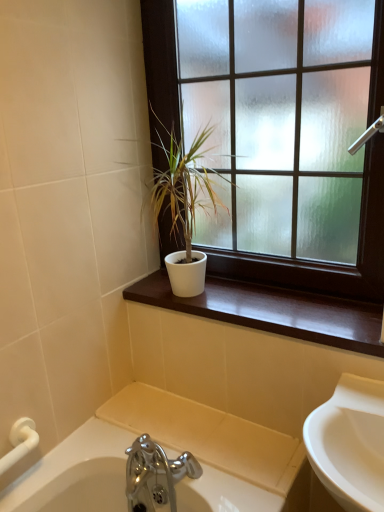
The width and height of the screenshot is (384, 512). I want to click on free space in front of white matte window at upper center, so click(282, 314).